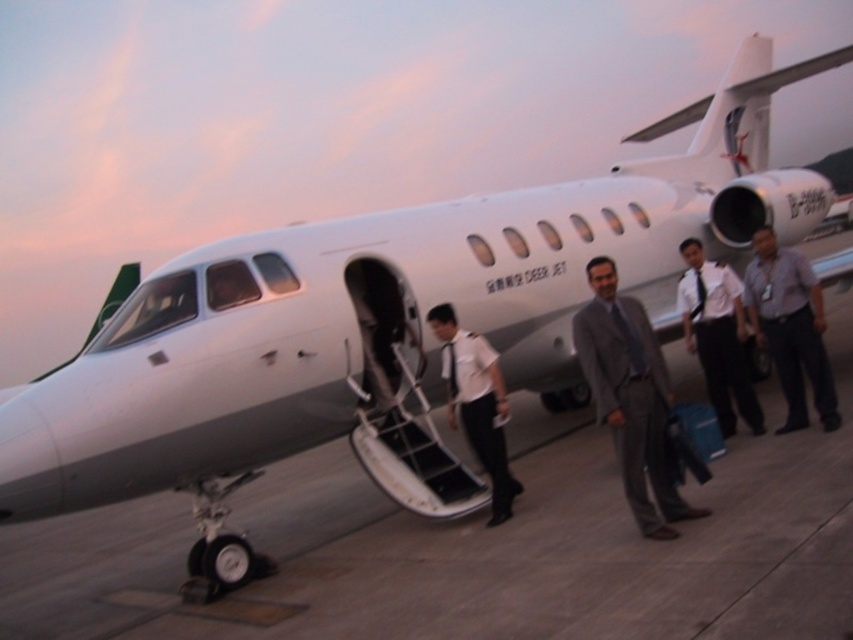
You are standing on the gray concrete tarmac at center and want to approach the white uniform at center. Which direction should you move to get closer?

Since the gray concrete tarmac at center is closer to the viewer than the white uniform at center, you should move forward towards the white uniform at center to get closer.

You are a passenger on the DEER JET and you want to exit the plane. You see the gray concrete tarmac at center and the white uniform at center. Which one is lower?

A: The gray concrete tarmac at center is below the white uniform at center, so the gray concrete tarmac at center is lower.

You are a photographer trying to capture a clear photo of the gray suit at center and white shirt at center. Which object might block the other when positioning your camera?

The gray suit at center might block the white shirt at center since it is wider than the white shirt at center.